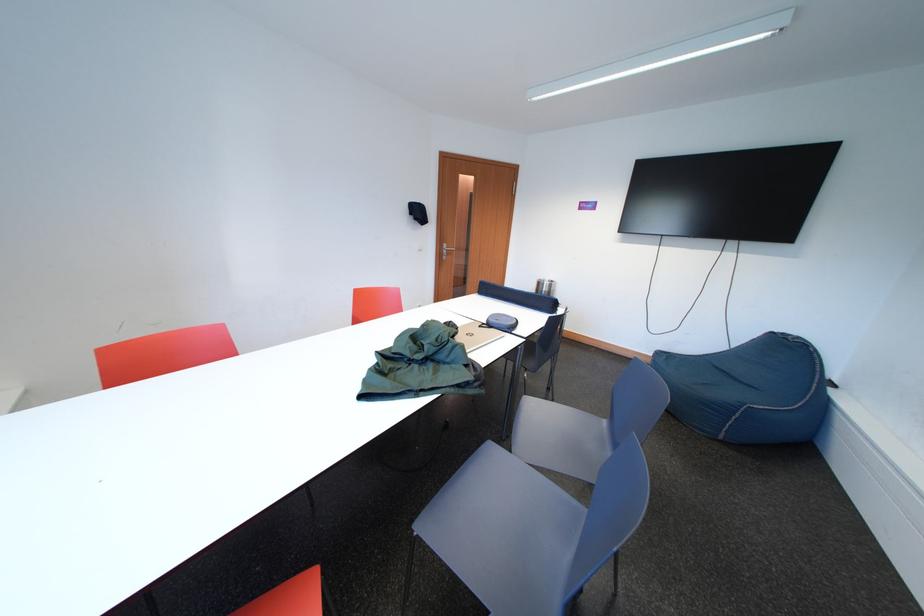
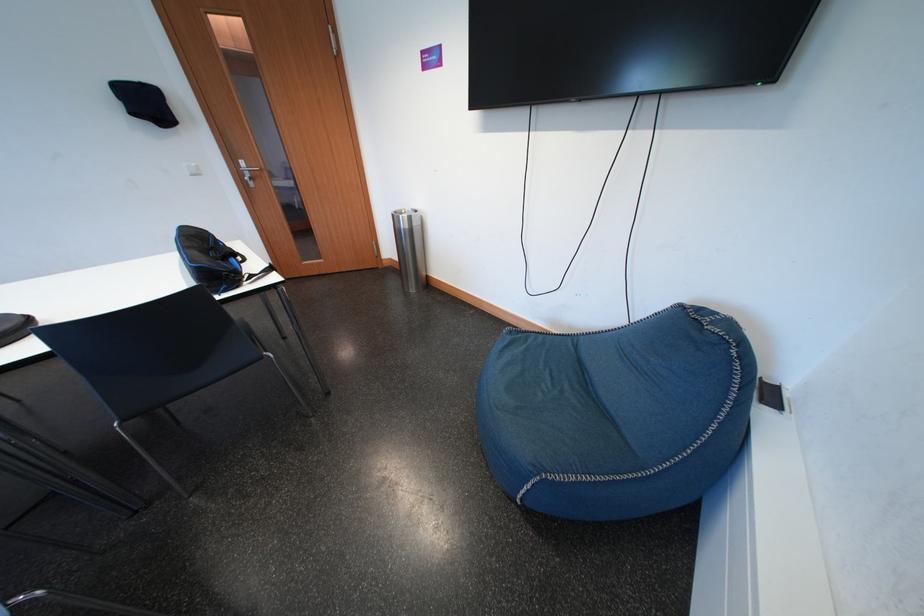
What movement of the cameraman would produce the second image?

The cameraman moved toward right, forward.